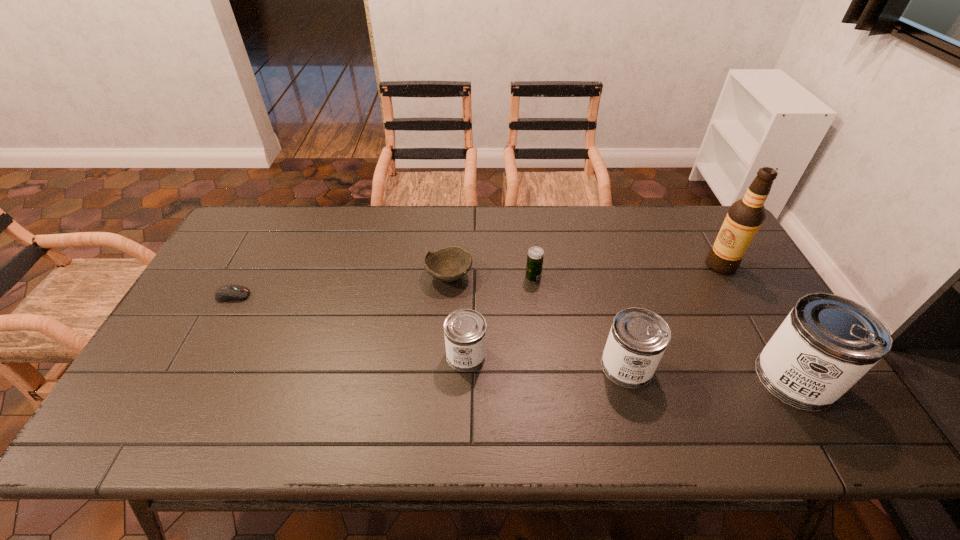
At what (x,y) coordinates should I click in order to perform the action: click on free location located on the right of the leftmost can. Please return your answer as a coordinate pair (x, y). The image size is (960, 540). Looking at the image, I should click on (561, 355).

Image resolution: width=960 pixels, height=540 pixels. In order to click on vacant region located 0.180m on the back of the fifth object from left to right in this screenshot , I will do `click(607, 295)`.

You are a GUI agent. You are given a task and a screenshot of the screen. Output one action in this format:
    pyautogui.click(x=<x>, y=<y>)
    Task: Click on the vacant region located 0.210m on the back of the rightmost can
    Image resolution: width=960 pixels, height=540 pixels.
    Given the screenshot: What is the action you would take?
    pyautogui.click(x=743, y=289)

The width and height of the screenshot is (960, 540). In order to click on vacant region located 0.320m on the right of the beer can in this screenshot , I will do `click(647, 278)`.

Where is `vacant space located 0.400m on the label of the tallest object`? The image size is (960, 540). vacant space located 0.400m on the label of the tallest object is located at coordinates (577, 265).

At what (x,y) coordinates should I click in order to perform the action: click on free space located on the label of the tallest object. Please return your answer as a coordinate pair (x, y). This screenshot has width=960, height=540. Looking at the image, I should click on (629, 265).

Find the location of `vacant space located 0.190m on the label of the tallest object`. vacant space located 0.190m on the label of the tallest object is located at coordinates (644, 265).

Locate an element on the screen. free spot located 0.170m on the button of the leftmost object is located at coordinates (308, 295).

The image size is (960, 540). I want to click on free spot located on the right of the second shortest object, so click(516, 276).

Locate an element on the screen. This screenshot has width=960, height=540. object at the left edge is located at coordinates (231, 292).